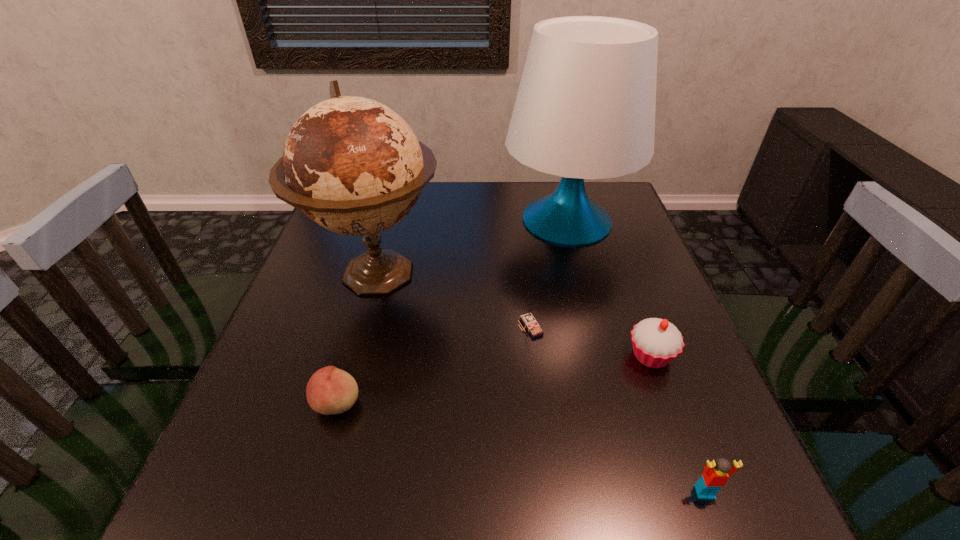
This screenshot has height=540, width=960. I want to click on table lamp, so click(585, 109).

I want to click on globe, so click(x=354, y=166).

Image resolution: width=960 pixels, height=540 pixels. Identify the location of matchbox. (527, 318).

Where is `cupcake`? This screenshot has height=540, width=960. cupcake is located at coordinates (656, 342).

Locate an element on the screen. This screenshot has height=540, width=960. the nearest object is located at coordinates (716, 473).

Identify the location of peach. (330, 390).

Locate an element on the screen. This screenshot has height=540, width=960. the fifth farthest object is located at coordinates (330, 390).

Find the location of `free space located 0.260m on the front-facing side of the table lamp`. free space located 0.260m on the front-facing side of the table lamp is located at coordinates (411, 220).

I want to click on free space located 0.160m on the front-facing side of the table lamp, so click(445, 220).

Where is `vacant point located 0.270m on the front-facing side of the table lamp`? The height and width of the screenshot is (540, 960). vacant point located 0.270m on the front-facing side of the table lamp is located at coordinates (407, 220).